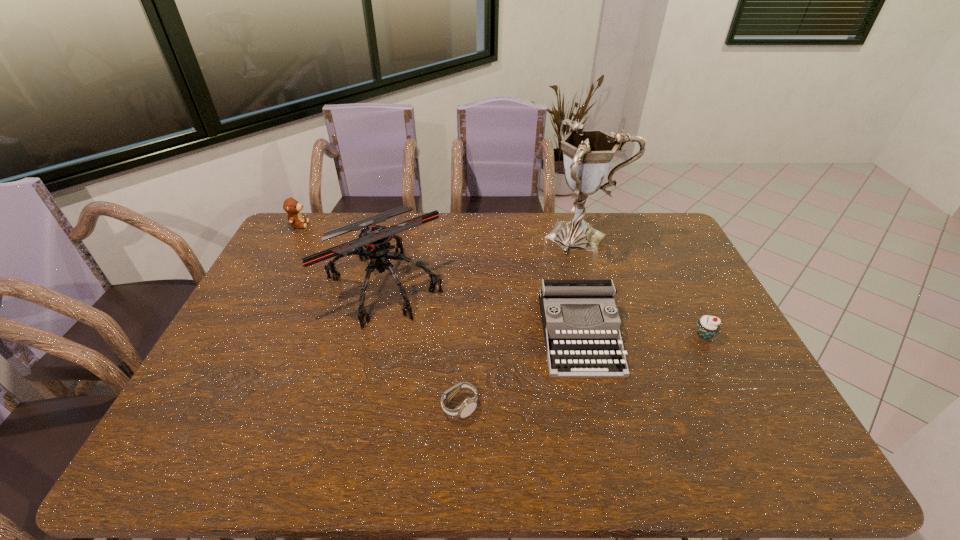
The height and width of the screenshot is (540, 960). What are the coordinates of `blank area in the image that satisfies the following two spatial constraints: 1. on the face of the leftmost object; 2. on the right side of the cupcake` in the screenshot? It's located at (239, 335).

This screenshot has height=540, width=960. Identify the location of blank space that satisfies the following two spatial constraints: 1. on the face of the leftmost object; 2. on the back side of the trophy cup. (293, 236).

This screenshot has height=540, width=960. Identify the location of vacant space that satisfies the following two spatial constraints: 1. on the face of the fifth shortest object; 2. on the left side of the leftmost object. (267, 285).

What are the coordinates of `vacant position in the image that satisfies the following two spatial constraints: 1. on the face of the leftmost object; 2. on the back side of the second object from left to right` in the screenshot? It's located at (267, 285).